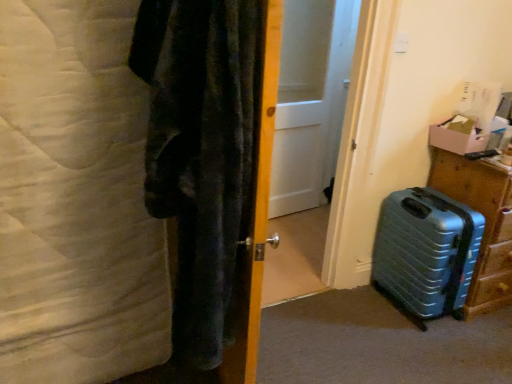
Locate an element on the screen. The height and width of the screenshot is (384, 512). metallic blue suitcase at lower right is located at coordinates (426, 253).

What do you see at coordinates (485, 223) in the screenshot?
I see `metallic blue suitcase at lower right` at bounding box center [485, 223].

The width and height of the screenshot is (512, 384). Identify the location of white soft blanket at left. (76, 199).

Where is `metallic blue suitcase at lower right`? The width and height of the screenshot is (512, 384). metallic blue suitcase at lower right is located at coordinates (426, 253).

From the image's perspective, is wooden door at center above metallic blue suitcase at lower right?

Yes, from the image's perspective, wooden door at center is above metallic blue suitcase at lower right.

How different are the orientations of wooden door at center and metallic blue suitcase at lower right in degrees?

The facing directions of wooden door at center and metallic blue suitcase at lower right are 79.5 degrees apart.

Is wooden door at center far away from metallic blue suitcase at lower right?

wooden door at center is positioned a significant distance from metallic blue suitcase at lower right.

Consider the image. Considering the relative sizes of wooden door at center and metallic blue suitcase at lower right in the image provided, is wooden door at center bigger than metallic blue suitcase at lower right?

Indeed, wooden door at center has a larger size compared to metallic blue suitcase at lower right.

Considering the relative positions of wooden door at center and cardboard box at right in the image provided, is wooden door at center to the right of cardboard box at right from the viewer's perspective?

In fact, wooden door at center is to the left of cardboard box at right.

Which point is more forward, (250, 240) or (448, 122)?

Positioned in front is point (250, 240).

From the image's perspective, is wooden door at center below cardboard box at right?

Yes.

Can you tell me how much wooden door at center and cardboard box at right differ in facing direction?

79.5 degrees.

Locate an element on the screen. This screenshot has width=512, height=384. box that appears in front of the white matte door at center is located at coordinates (465, 135).

Is cardboard box at right surrounding white matte door at center?

No, white matte door at center is located outside of cardboard box at right.

Is cardboard box at right oriented towards white matte door at center?

No, cardboard box at right is not oriented towards white matte door at center.

Looking at this image, how different are the orientations of cardboard box at right and metallic blue suitcase at lower right in degrees?

The angle between the facing direction of cardboard box at right and the facing direction of metallic blue suitcase at lower right is 0.67 degrees.

Between cardboard box at right and metallic blue suitcase at lower right, which one has smaller size?

Smaller between the two is cardboard box at right.

Is cardboard box at right surrounding metallic blue suitcase at lower right?

No, metallic blue suitcase at lower right is located outside of cardboard box at right.

From a real-world perspective, does cardboard box at right stand above metallic blue suitcase at lower right?

Yes.

From the image's perspective, is cardboard box at right located above or below wooden door at center?

From the image's perspective, cardboard box at right appears above wooden door at center.

Is cardboard box at right facing away from wooden door at center?

cardboard box at right does not have its back to wooden door at center.

Looking at this image, from a real-world perspective, is cardboard box at right physically located above or below wooden door at center?

Clearly, from a real-world perspective, cardboard box at right is above wooden door at center.

Identify the location of box that appears above the wooden door at center (from a real-world perspective). This screenshot has height=384, width=512. (465, 135).

You are a GUI agent. You are given a task and a screenshot of the screen. Output one action in this format:
    pyautogui.click(x=<x>, y=<y>)
    Task: Click on the box located above the metallic blue suitcase at lower right (from a real-world perspective)
    The width and height of the screenshot is (512, 384).
    Given the screenshot: What is the action you would take?
    pyautogui.click(x=465, y=135)

Looking at this image, can we say metallic blue suitcase at lower right lies outside cardboard box at right?

metallic blue suitcase at lower right is positioned outside cardboard box at right.

Consider the image. From a real-world perspective, does metallic blue suitcase at lower right sit lower than cardboard box at right?

Correct, in the physical world, metallic blue suitcase at lower right is lower than cardboard box at right.

Which object is thinner, metallic blue suitcase at lower right or cardboard box at right?

cardboard box at right.

Consider the image. Would you say cardboard box at right is a long distance from white soft blanket at left?

Yes, cardboard box at right is far from white soft blanket at left.

Based on their sizes in the image, would you say cardboard box at right is bigger or smaller than white soft blanket at left?

Clearly, cardboard box at right is smaller in size than white soft blanket at left.

Which is in front, point (453, 125) or point (25, 35)?

The point (25, 35) is closer.

Would you say cardboard box at right is outside white soft blanket at left?

Yes, cardboard box at right is not within white soft blanket at left.

Identify the location of suitcase located underneath the wooden door at center (from a real-world perspective). (426, 253).

Find the location of a particular element. box above the wooden door at center (from the image's perspective) is located at coordinates (465, 135).

Looking at the image, which one is located further to white soft blanket at left, wooden door at center or white matte door at center?

white matte door at center.

From the image, which object appears to be farther from white matte door at center, wooden door at center or metallic blue suitcase at lower right?

The object further to white matte door at center is wooden door at center.

Looking at the image, which one is located closer to metallic blue suitcase at lower right, wooden door at center or cardboard box at right?

Among the two, cardboard box at right is located nearer to metallic blue suitcase at lower right.

Which object lies further to the anchor point metallic blue suitcase at lower right, wooden door at center or metallic blue suitcase at lower right?

Among the two, wooden door at center is located further to metallic blue suitcase at lower right.

From the image, which object appears to be nearer to metallic blue suitcase at lower right, cardboard box at right or wooden door at center?

Among the two, cardboard box at right is located nearer to metallic blue suitcase at lower right.

Looking at the image, which one is located closer to wooden door at center, white soft blanket at left or metallic blue suitcase at lower right?

white soft blanket at left.

Consider the image. From the image, which object appears to be farther from cardboard box at right, metallic blue suitcase at lower right or metallic blue suitcase at lower right?

Based on the image, metallic blue suitcase at lower right appears to be further to cardboard box at right.

Consider the image. Considering their positions, is wooden door at center positioned closer to white matte door at center than metallic blue suitcase at lower right?

The object closer to white matte door at center is metallic blue suitcase at lower right.

Locate an element on the screen. suitcase between white soft blanket at left and white matte door at center along the z-axis is located at coordinates (426, 253).

In order to click on suitcase between white soft blanket at left and cardboard box at right from left to right in this screenshot , I will do `click(426, 253)`.

Where is `door between white soft blanket at left and metallic blue suitcase at lower right`? Image resolution: width=512 pixels, height=384 pixels. door between white soft blanket at left and metallic blue suitcase at lower right is located at coordinates (256, 202).

Find the location of `box between white matte door at center and metallic blue suitcase at lower right in the up-down direction`. box between white matte door at center and metallic blue suitcase at lower right in the up-down direction is located at coordinates (465, 135).